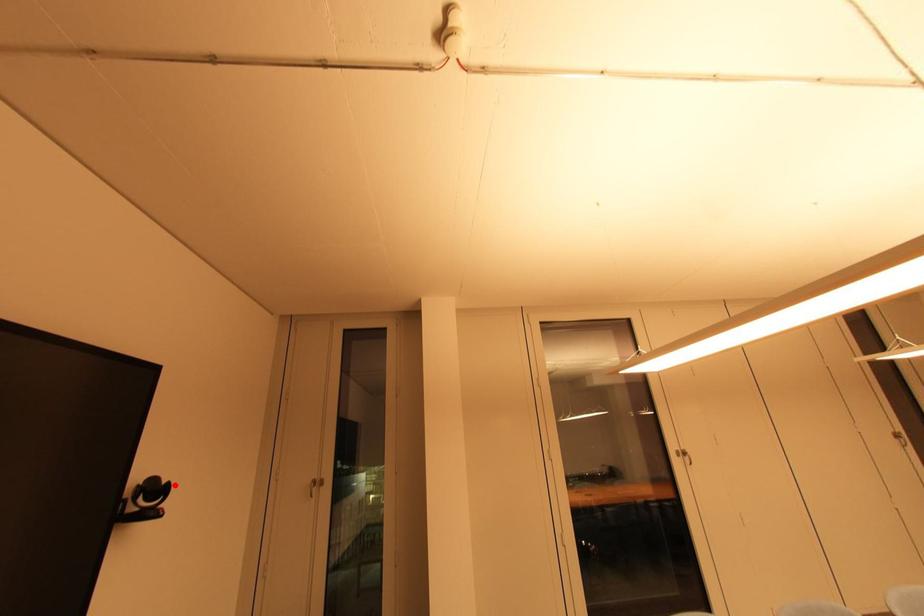
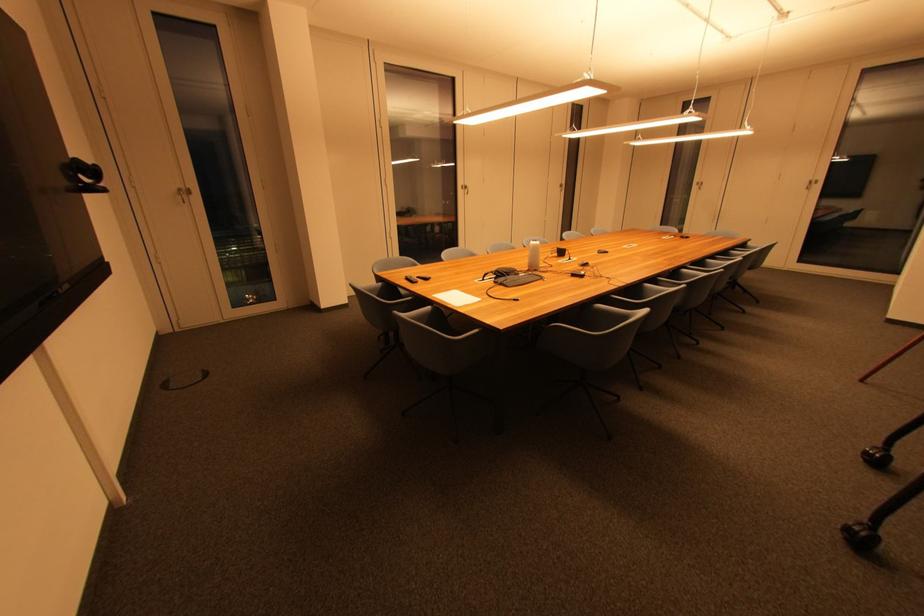
Find the pixel in the second image that matches the highlighted location in the first image.

(101, 168)